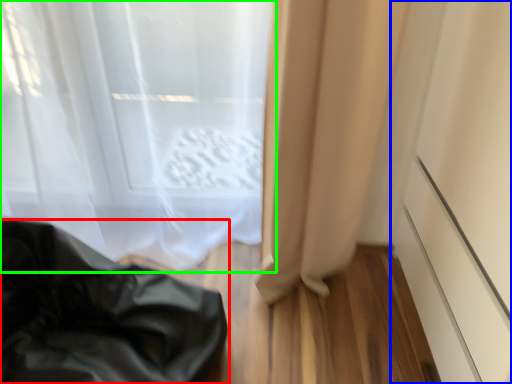
Question: Which object is positioned closest to furniture (highlighted by a red box)? Select from screen door (highlighted by a blue box) and curtain (highlighted by a green box).

Choices:
 (A) screen door
 (B) curtain

Answer: (B)